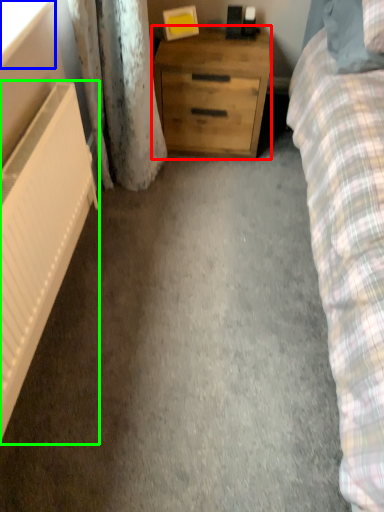
Question: Considering the real-world distances, which object is farthest from chest of drawers (highlighted by a red box)? window screen (highlighted by a blue box) or radiator (highlighted by a green box)?

Choices:
 (A) window screen
 (B) radiator

Answer: (A)